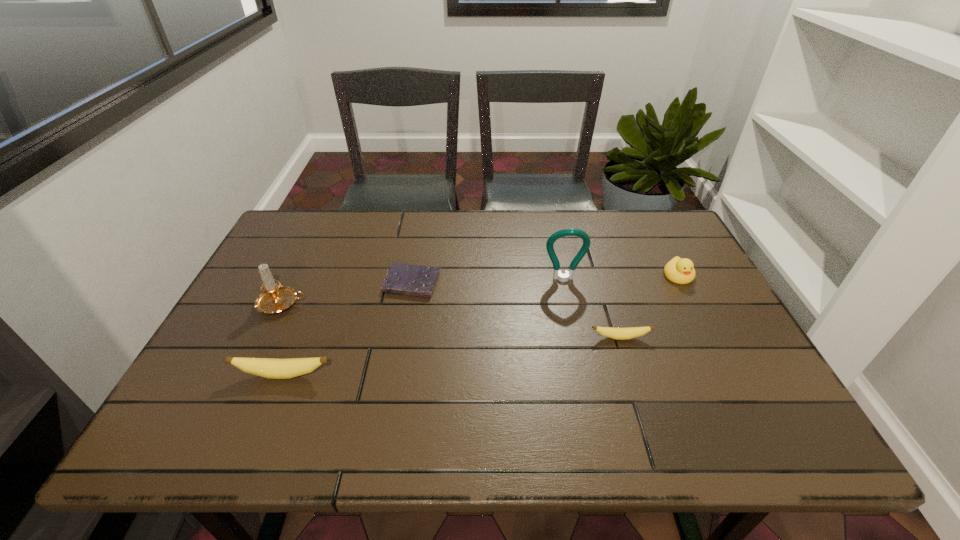
This screenshot has height=540, width=960. Identify the location of vacant region at the far edge of the desktop. (631, 243).

The image size is (960, 540). I want to click on vacant region at the near edge, so click(x=495, y=374).

In the image, there is a desktop. Where is `vacant space at the left edge`? This screenshot has height=540, width=960. vacant space at the left edge is located at coordinates (264, 358).

Locate an element on the screen. The width and height of the screenshot is (960, 540). vacant space at the right edge of the desktop is located at coordinates (696, 320).

At what (x,y) coordinates should I click in order to perform the action: click on free space at the far left corner of the desktop. Please return your answer as a coordinate pair (x, y). The height and width of the screenshot is (540, 960). Looking at the image, I should click on (298, 220).

In the image, there is a desktop. What are the coordinates of `vacant space at the near left corner` in the screenshot? It's located at (197, 395).

The image size is (960, 540). In order to click on vacant space at the far right corner of the desktop in this screenshot , I will do `click(658, 232)`.

Find the location of a particular element. The height and width of the screenshot is (540, 960). vacant space at the near right corner is located at coordinates pyautogui.click(x=718, y=380).

Identify the location of vacant region between the duckling and the bottle opener. The width and height of the screenshot is (960, 540). (621, 278).

Find the location of a particular element. The width and height of the screenshot is (960, 540). free area in between the fifth farthest object and the left banana is located at coordinates (452, 356).